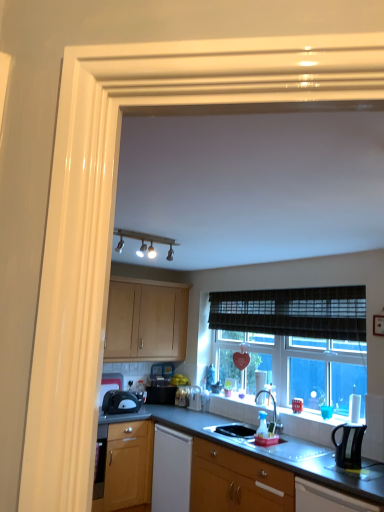
You are a GUI agent. You are given a task and a screenshot of the screen. Output one action in this format:
    pyautogui.click(x=<x>, y=<y>)
    Task: Click on the empty space that is ontop of matte white track lights at upper center (from a real-world perspective)
    Image resolution: width=384 pixels, height=512 pixels.
    Given the screenshot: What is the action you would take?
    tap(155, 231)